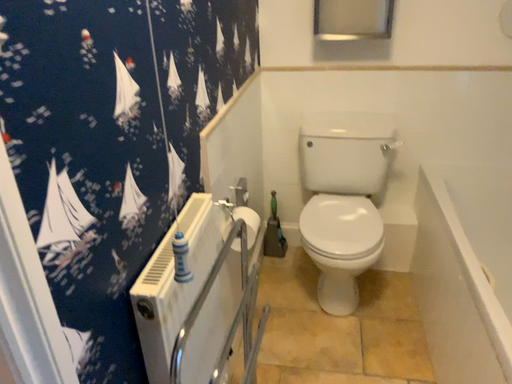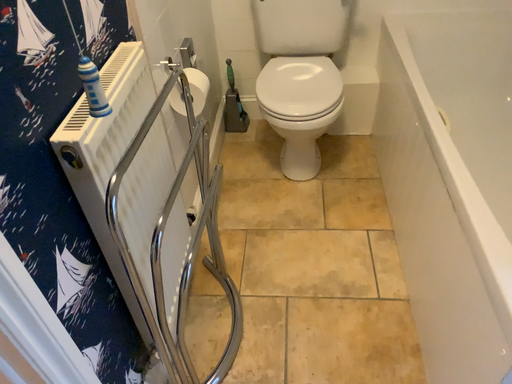
Question: How did the camera likely rotate when shooting the video?

Choices:
 (A) rotated upward
 (B) rotated downward

Answer: (B)